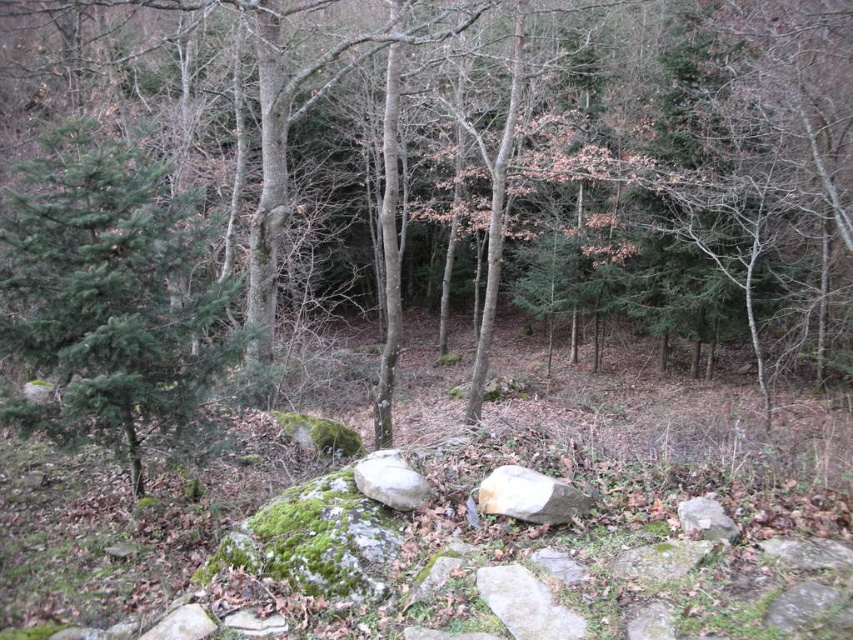
Question: Considering the relative positions of green needle-like at left and smooth gray rock at center in the image provided, where is green needle-like at left located with respect to smooth gray rock at center?

Choices:
 (A) right
 (B) left

Answer: (B)

Question: Among these objects, which one is nearest to the camera?

Choices:
 (A) smooth beige rock at center
 (B) green needle-like at left

Answer: (A)

Question: Is green needle-like at left to the left of smooth beige rock at center from the viewer's perspective?

Choices:
 (A) no
 (B) yes

Answer: (B)

Question: Which of these objects is positioned farthest from the green needle-like at left?

Choices:
 (A) smooth gray rock at center
 (B) smooth beige rock at center

Answer: (B)

Question: Is smooth beige rock at center in front of smooth gray rock at center?

Choices:
 (A) yes
 (B) no

Answer: (A)

Question: Considering the real-world distances, which object is closest to the green needle-like at left?

Choices:
 (A) smooth gray rock at center
 (B) smooth beige rock at center

Answer: (A)